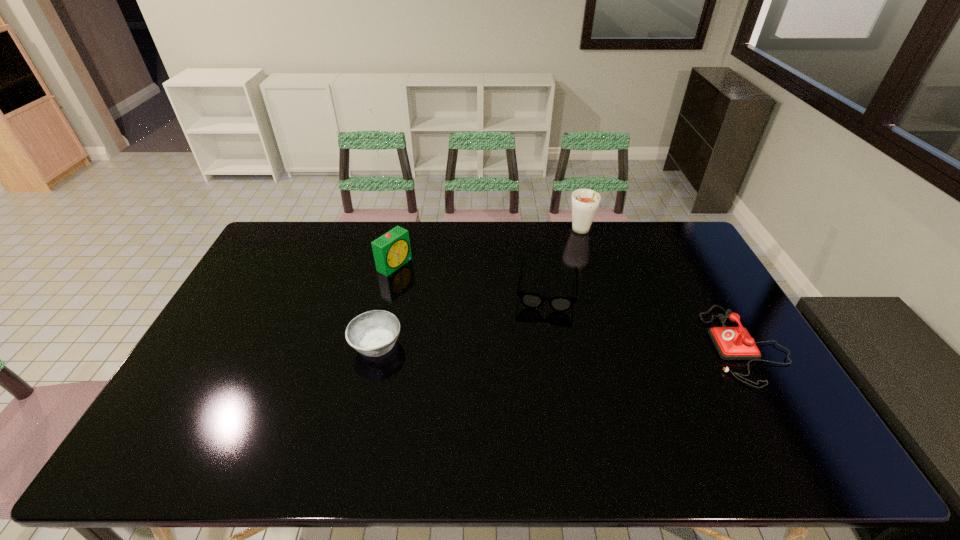
Identify the location of alarm clock that is at the far edge. This screenshot has height=540, width=960. (392, 250).

Identify the location of root beer at the far edge. (585, 202).

The image size is (960, 540). I want to click on object that is at the right edge, so click(732, 343).

This screenshot has width=960, height=540. I want to click on free region at the far edge of the desktop, so click(419, 257).

Where is `free space at the near edge of the desktop`? The width and height of the screenshot is (960, 540). free space at the near edge of the desktop is located at coordinates (365, 400).

This screenshot has height=540, width=960. I want to click on vacant space at the left edge of the desktop, so click(x=257, y=302).

This screenshot has height=540, width=960. What are the coordinates of `vacant position at the right edge of the desktop` in the screenshot? It's located at (758, 376).

Identify the location of free point at the far left corner. (275, 248).

Identify the location of free space between the second object from right to left and the spectacles. This screenshot has width=960, height=540. (564, 261).

What are the coordinates of `unoccupied area between the fourth shortest object and the root beer` in the screenshot? It's located at (488, 248).